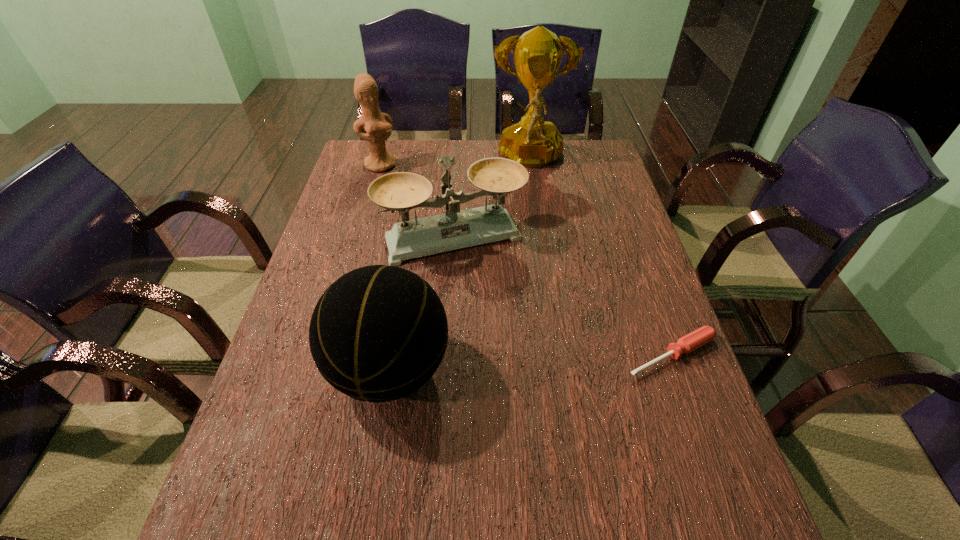
Where is `basketball`? Image resolution: width=960 pixels, height=540 pixels. basketball is located at coordinates (378, 333).

Find the location of a particular element. The image size is (960, 540). the rightmost object is located at coordinates (694, 340).

The image size is (960, 540). In order to click on the shortest object in this screenshot , I will do `click(694, 340)`.

Where is `award`? Image resolution: width=960 pixels, height=540 pixels. award is located at coordinates (532, 142).

Locate an element on the screen. The height and width of the screenshot is (540, 960). the third farthest object is located at coordinates (402, 191).

This screenshot has width=960, height=540. Identify the location of figurine. (377, 125).

This screenshot has width=960, height=540. I want to click on vacant region located on the left of the basketball, so click(302, 369).

At what (x,y) coordinates should I click in order to perform the action: click on vacant space located 0.110m on the back of the rightmost object. Please return your answer as a coordinate pair (x, y). Looking at the image, I should click on (651, 296).

The height and width of the screenshot is (540, 960). I want to click on vacant space situated 0.320m on the front side of the tallest object, so click(534, 247).

Locate an element on the screen. This screenshot has width=960, height=540. vacant region located on the front side of the tallest object is located at coordinates (534, 233).